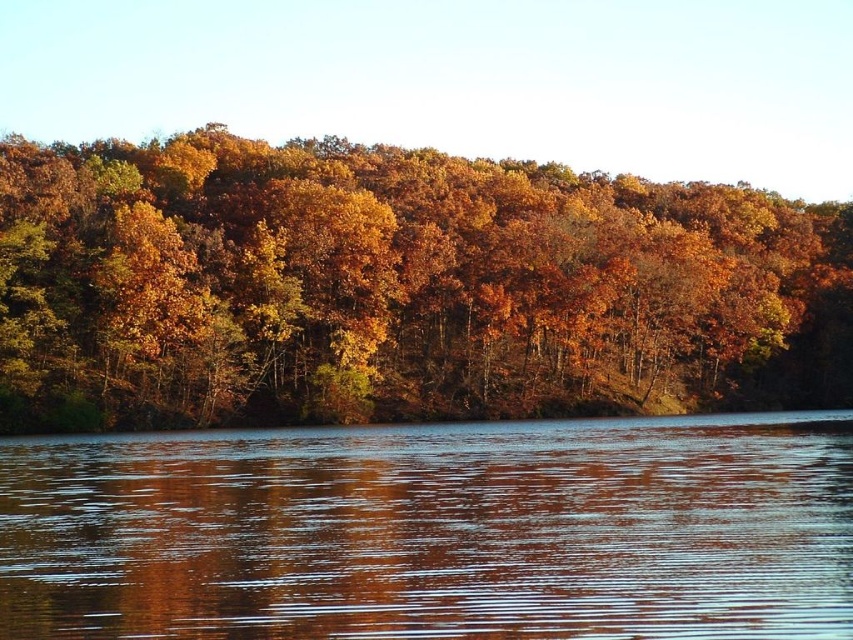
Question: Is autumn leaves at center below glossy reflective water at center?

Choices:
 (A) no
 (B) yes

Answer: (A)

Question: Which object is closer to the camera taking this photo?

Choices:
 (A) glossy reflective water at center
 (B) autumn leaves at center

Answer: (A)

Question: Does autumn leaves at center lie behind glossy reflective water at center?

Choices:
 (A) yes
 (B) no

Answer: (A)

Question: Can you confirm if autumn leaves at center is positioned to the left of glossy reflective water at center?

Choices:
 (A) yes
 (B) no

Answer: (A)

Question: Which point appears closest to the camera in this image?

Choices:
 (A) (390, 618)
 (B) (526, 349)

Answer: (A)